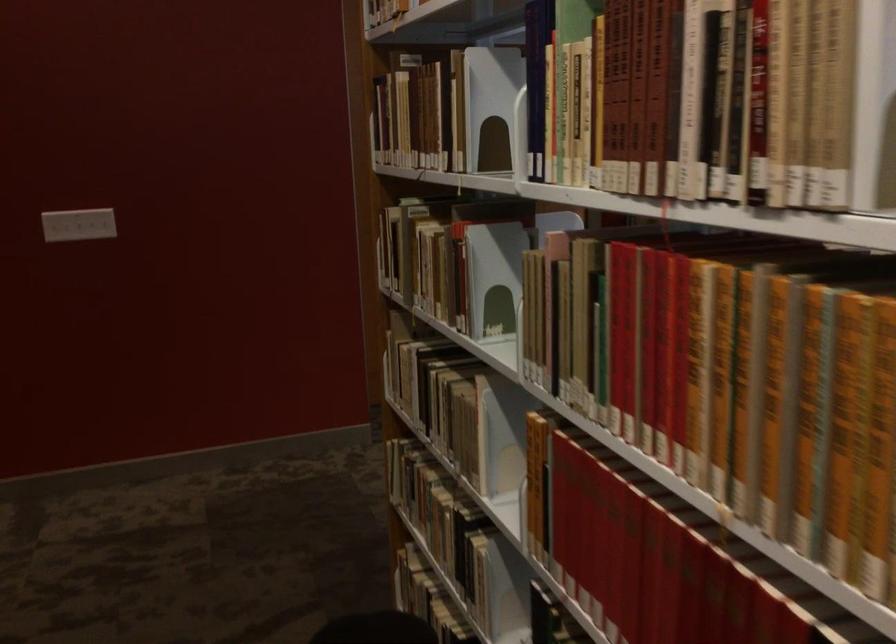
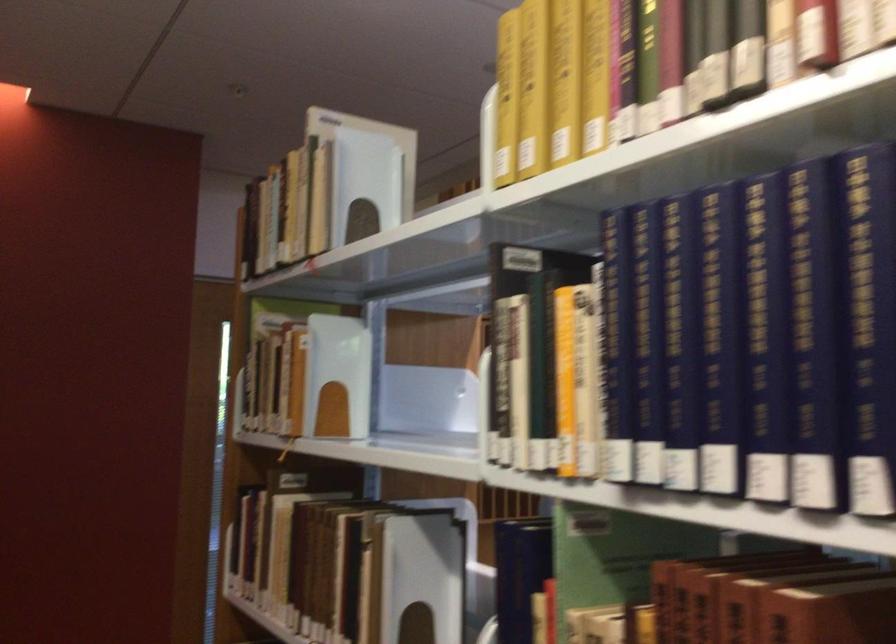
Question: The images are taken continuously from a first-person perspective. In which direction is your viewpoint rotating?

Choices:
 (A) Left
 (B) Right
 (C) Up
 (D) Down

Answer: (C)